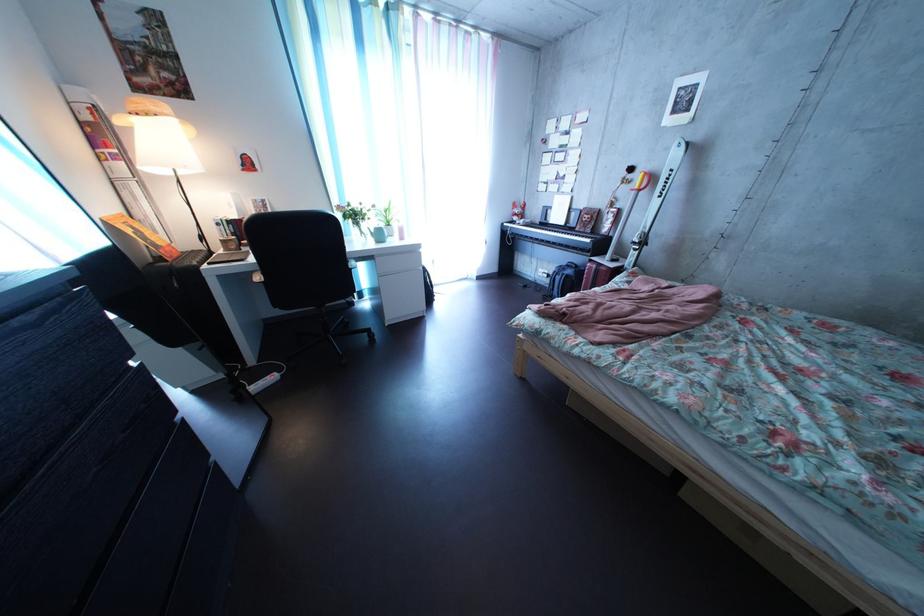
Which object does [381,235] point to?

It refers to a white teapot.